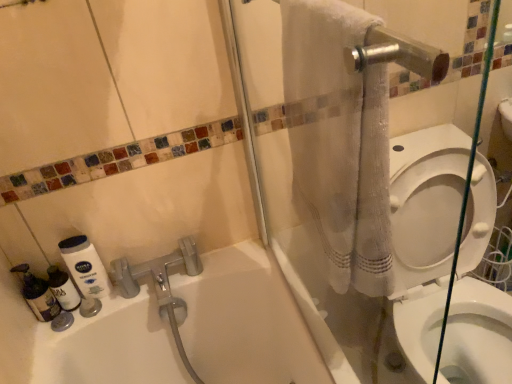
Question: Considering the positions of translucent plastic bottle at lower left, acting as the second cleaning product starting from the left, and white glossy toilet at right in the image, is translucent plastic bottle at lower left, acting as the second cleaning product starting from the left, taller or shorter than white glossy toilet at right?

Choices:
 (A) tall
 (B) short

Answer: (B)

Question: Would you say translucent plastic bottle at lower left, the second cleaning product when ordered from right to left, is to the left or to the right of white glossy toilet at right in the picture?

Choices:
 (A) left
 (B) right

Answer: (A)

Question: Which of these objects is positioned closest to the white matte lotion at lower left, which is the first cleaning product from right to left?

Choices:
 (A) white glossy toilet at right
 (B) translucent plastic bottles at lower left, the first cleaning product viewed from the left
 (C) white textured towel at upper right
 (D) translucent plastic bottle at lower left, acting as the second cleaning product starting from the left

Answer: (D)

Question: Which object is positioned farthest from the translucent plastic bottle at lower left, acting as the second cleaning product starting from the left?

Choices:
 (A) white matte lotion at lower left, which is the first cleaning product from right to left
 (B) translucent plastic bottles at lower left, the first cleaning product viewed from the left
 (C) white glossy toilet at right
 (D) white textured towel at upper right

Answer: (C)